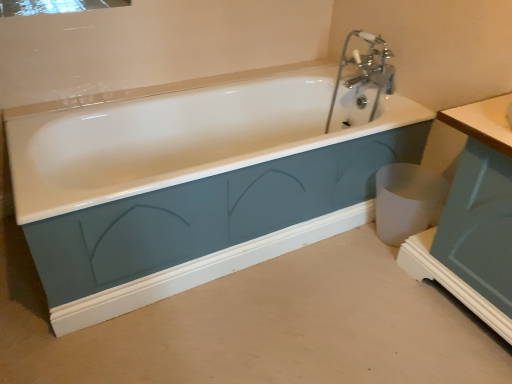
The height and width of the screenshot is (384, 512). What do you see at coordinates (407, 200) in the screenshot? I see `white matte trash can at lower right` at bounding box center [407, 200].

What do you see at coordinates (474, 219) in the screenshot?
I see `matte teal cabinet at right` at bounding box center [474, 219].

Describe the element at coordinates (194, 181) in the screenshot. The height and width of the screenshot is (384, 512). I see `white glossy bathtub at center` at that location.

The width and height of the screenshot is (512, 384). I want to click on white matte trash can at lower right, so click(x=407, y=200).

Which is more to the right, clear glass mirror at upper left or matte teal cabinet at right?

Positioned to the right is matte teal cabinet at right.

From the image's perspective, is clear glass mirror at upper left above or below matte teal cabinet at right?

Based on their image positions, clear glass mirror at upper left is located above matte teal cabinet at right.

Is clear glass mirror at upper left turned away from matte teal cabinet at right?

clear glass mirror at upper left is not turned away from matte teal cabinet at right.

Where is `mirror on the left of white matte trash can at lower right`? The width and height of the screenshot is (512, 384). mirror on the left of white matte trash can at lower right is located at coordinates (54, 6).

Looking at this image, from a real-world perspective, is clear glass mirror at upper left located beneath white matte trash can at lower right?

No.

Could you tell me if clear glass mirror at upper left is turned towards white matte trash can at lower right?

No, clear glass mirror at upper left does not turn towards white matte trash can at lower right.

Is clear glass mirror at upper left wider than white matte trash can at lower right?

Correct, the width of clear glass mirror at upper left exceeds that of white matte trash can at lower right.

From the image's perspective, is white matte trash can at lower right below clear glass mirror at upper left?

Yes, from the image's perspective, white matte trash can at lower right is beneath clear glass mirror at upper left.

Is white matte trash can at lower right positioned before clear glass mirror at upper left?

No.

Does white matte trash can at lower right have a greater width compared to clear glass mirror at upper left?

In fact, white matte trash can at lower right might be narrower than clear glass mirror at upper left.

You are a GUI agent. You are given a task and a screenshot of the screen. Output one action in this format:
    pyautogui.click(x=<x>, y=<y>)
    Task: Click on the toilet bowl lying below the clear glass mirror at upper left (from the image's perspective)
    The height and width of the screenshot is (384, 512).
    Given the screenshot: What is the action you would take?
    pyautogui.click(x=407, y=200)

Would you say white glossy bathtub at center is inside or outside matte teal cabinet at right?

The correct answer is: outside.

In the image, there is a matte teal cabinet at right. Identify the location of bathtub above it (from the image's perspective). The image size is (512, 384). (194, 181).

From a real-world perspective, who is located lower, white glossy bathtub at center or matte teal cabinet at right?

From a 3D spatial view, white glossy bathtub at center is below.

Can you tell me how much white glossy bathtub at center and matte teal cabinet at right differ in facing direction?

89.9 degrees.

Consider the image. Is white glossy bathtub at center in front of or behind white matte trash can at lower right in the image?

Clearly, white glossy bathtub at center is in front of white matte trash can at lower right.

Measure the distance from white glossy bathtub at center to white matte trash can at lower right.

white glossy bathtub at center is 21.25 inches away from white matte trash can at lower right.

Which is behind, point (362, 155) or point (431, 215)?

The point (431, 215) is more distant.

What's the angular difference between white glossy bathtub at center and white matte trash can at lower right's facing directions?

90.8 degrees separate the facing orientations of white glossy bathtub at center and white matte trash can at lower right.

Is clear glass mirror at upper left aimed at white glossy bathtub at center?

No, clear glass mirror at upper left is not turned towards white glossy bathtub at center.

Consider the image. Relative to white glossy bathtub at center, is clear glass mirror at upper left in front or behind?

Visually, clear glass mirror at upper left is located behind white glossy bathtub at center.

From a real-world perspective, which is physically below, clear glass mirror at upper left or white glossy bathtub at center?

white glossy bathtub at center, from a real-world perspective.

From the image's perspective, is white matte trash can at lower right located above white glossy bathtub at center?

No, from the image's perspective, white matte trash can at lower right is not on top of white glossy bathtub at center.

Consider the image. Which is nearer, (396, 219) or (297, 120)?

The point (396, 219) is closer.

Is white matte trash can at lower right touching white glossy bathtub at center?

No, white matte trash can at lower right is not making contact with white glossy bathtub at center.

What's the angular difference between white matte trash can at lower right and white glossy bathtub at center's facing directions?

90.8 degrees.

Identify the location of mirror behind the matte teal cabinet at right. (54, 6).

In the image, there is a white matte trash can at lower right. At what (x,y) coordinates should I click in order to perform the action: click on mirror above it (from the image's perspective). Please return your answer as a coordinate pair (x, y). The width and height of the screenshot is (512, 384). Looking at the image, I should click on (54, 6).

Based on their spatial positions, is white matte trash can at lower right or matte teal cabinet at right closer to white glossy bathtub at center?

The object closer to white glossy bathtub at center is white matte trash can at lower right.

From the image, which object appears to be nearer to clear glass mirror at upper left, white glossy bathtub at center or white matte trash can at lower right?

white glossy bathtub at center is closer to clear glass mirror at upper left.

When comparing their distances from white matte trash can at lower right, does clear glass mirror at upper left or matte teal cabinet at right seem further?

clear glass mirror at upper left lies further to white matte trash can at lower right than the other object.

From the image, which object appears to be nearer to matte teal cabinet at right, white matte trash can at lower right or white glossy bathtub at center?

white matte trash can at lower right is positioned closer to the anchor matte teal cabinet at right.

Considering their positions, is white matte trash can at lower right positioned further to clear glass mirror at upper left than matte teal cabinet at right?

The object further to clear glass mirror at upper left is matte teal cabinet at right.

When comparing their distances from white glossy bathtub at center, does clear glass mirror at upper left or white matte trash can at lower right seem closer?

white matte trash can at lower right is closer to white glossy bathtub at center.

When comparing their distances from white glossy bathtub at center, does white matte trash can at lower right or clear glass mirror at upper left seem further?

The object further to white glossy bathtub at center is clear glass mirror at upper left.

Based on their spatial positions, is white glossy bathtub at center or matte teal cabinet at right closer to white matte trash can at lower right?

matte teal cabinet at right is closer to white matte trash can at lower right.

Where is `toilet bowl between clear glass mirror at upper left and matte teal cabinet at right from left to right`? toilet bowl between clear glass mirror at upper left and matte teal cabinet at right from left to right is located at coordinates (407, 200).

Locate an element on the screen. bathtub between clear glass mirror at upper left and white matte trash can at lower right from left to right is located at coordinates (194, 181).

At what (x,y) coordinates should I click in order to perform the action: click on toilet bowl between white glossy bathtub at center and matte teal cabinet at right. Please return your answer as a coordinate pair (x, y). This screenshot has height=384, width=512. Looking at the image, I should click on (407, 200).

This screenshot has height=384, width=512. In order to click on bathtub between clear glass mirror at upper left and matte teal cabinet at right from left to right in this screenshot , I will do `click(194, 181)`.